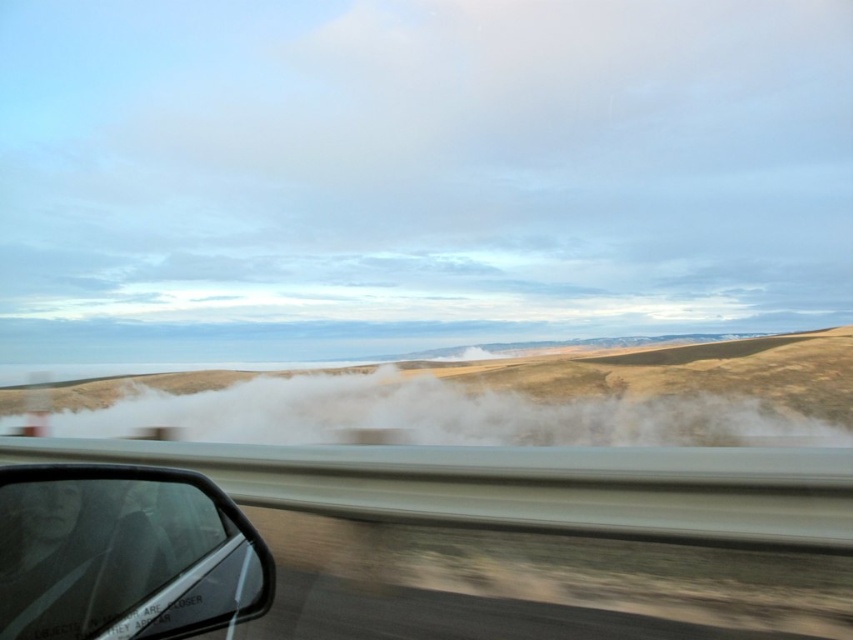
Question: Which object appears farthest from the camera in this image?

Choices:
 (A) cloudy sky at upper center
 (B) transparent plastic car window at lower left

Answer: (A)

Question: Which point is farther to the camera?

Choices:
 (A) (585, 426)
 (B) (93, 77)
 (C) (86, 476)

Answer: (B)

Question: Does cloudy sky at upper center come behind transparent plastic car window at lower left?

Choices:
 (A) no
 (B) yes

Answer: (B)

Question: Which point appears farthest from the camera in this image?

Choices:
 (A) (254, 388)
 (B) (125, 637)
 (C) (718, 10)

Answer: (C)

Question: Does transparent plastic car window at lower left appear over white dusty cloud at center?

Choices:
 (A) yes
 (B) no

Answer: (A)

Question: Can you confirm if transparent plastic car window at lower left is positioned above white dusty cloud at center?

Choices:
 (A) no
 (B) yes

Answer: (B)